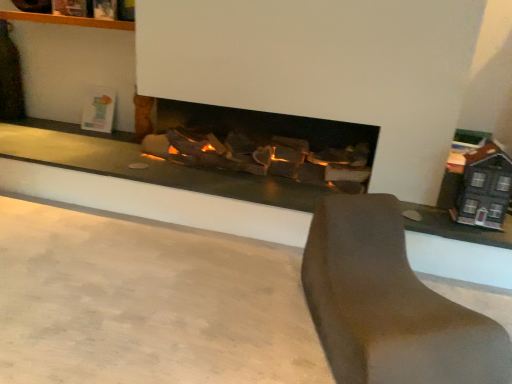
You are a GUI agent. You are given a task and a screenshot of the screen. Output one action in this format:
    pyautogui.click(x=<x>, y=<y>)
    Task: Click on the vacant space that is to the left of brown matte chair at lower right
    The height and width of the screenshot is (384, 512).
    Given the screenshot: What is the action you would take?
    pyautogui.click(x=217, y=315)